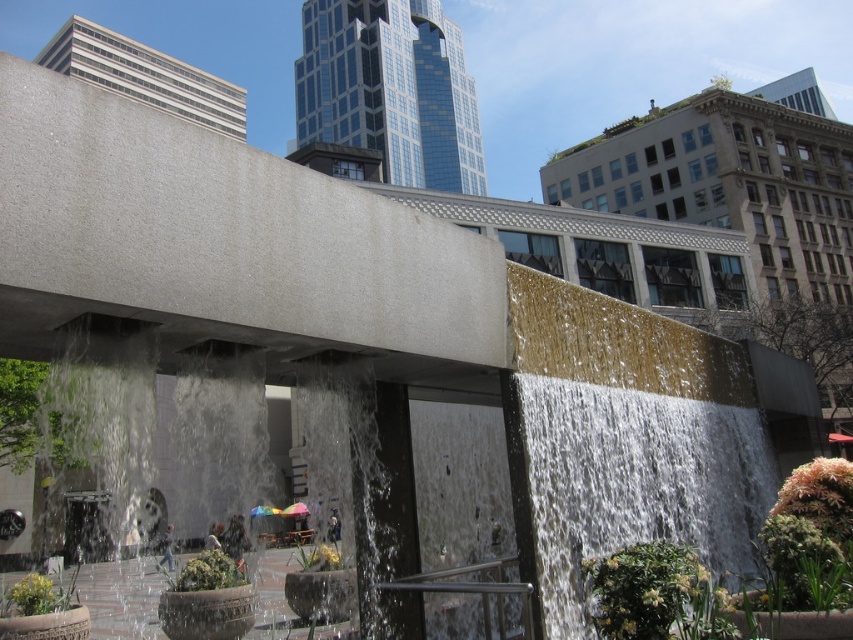
You are standing in the urban plaza and want to take a photo of the water feature. You notice two points marked on the water feature structure. Which point, point (654,472) or point (802,401), is closer to you?

Point (654,472) is closer to the viewer than point (802,401).

You are standing in the plaza and want to take a photo of the gold textured wall at center and the smooth concrete waterfall at center. Which object should you focus on first if you want both to be in sharp focus?

You should focus on the gold textured wall at center first because it is closer to you than the smooth concrete waterfall at center, so focusing on the closer object will ensure both are in focus.